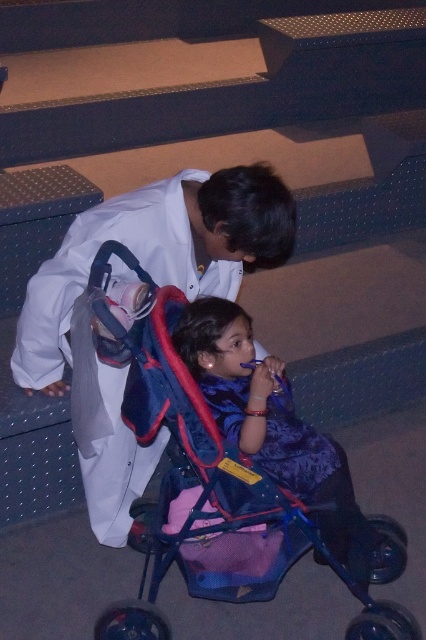
Question: Based on their relative distances, which object is nearer to the white matte coat at upper left?

Choices:
 (A) blue fabric stroller at lower center
 (B) blue plastic baby carriage at center

Answer: (B)

Question: Does white matte coat at upper left appear on the right side of blue fabric stroller at lower center?

Choices:
 (A) no
 (B) yes

Answer: (A)

Question: Which of the following is the farthest from the observer?

Choices:
 (A) white matte coat at upper left
 (B) blue plastic baby carriage at center

Answer: (A)

Question: Can you confirm if white matte coat at upper left is positioned below blue plastic baby carriage at center?

Choices:
 (A) no
 (B) yes

Answer: (A)

Question: Considering the relative positions of blue plastic baby carriage at center and blue fabric stroller at lower center in the image provided, where is blue plastic baby carriage at center located with respect to blue fabric stroller at lower center?

Choices:
 (A) above
 (B) below

Answer: (B)

Question: Which object is farther from the camera taking this photo?

Choices:
 (A) white matte coat at upper left
 (B) blue fabric stroller at lower center

Answer: (B)